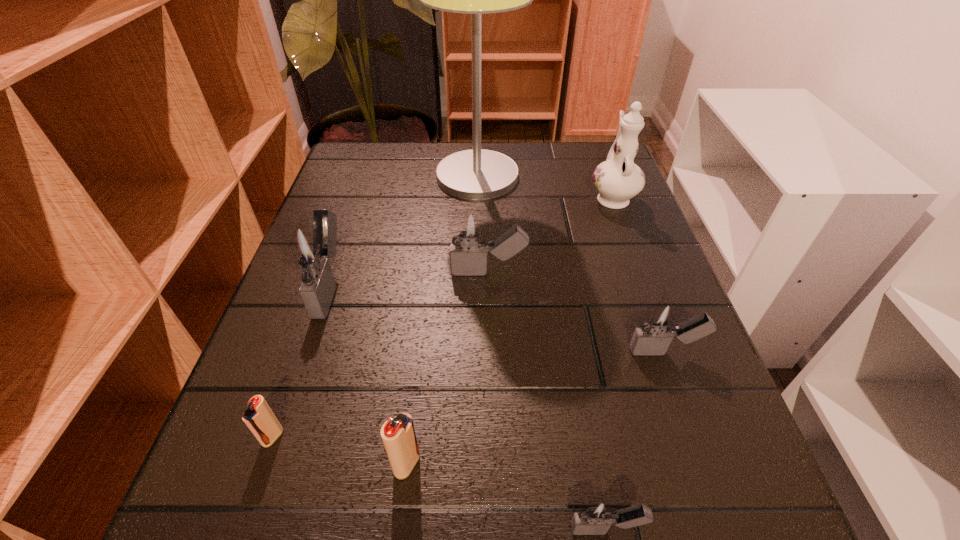
Locate an element on the screen. The height and width of the screenshot is (540, 960). the third nearest igniter is located at coordinates click(x=259, y=418).

The height and width of the screenshot is (540, 960). Find the location of `the smaller red igniter`. the smaller red igniter is located at coordinates (259, 418).

This screenshot has height=540, width=960. In order to click on vacant space located on the left of the tallest object in this screenshot , I will do `click(348, 176)`.

This screenshot has height=540, width=960. I want to click on vacant space located at the spout of the seventh shortest object, so click(x=592, y=143).

At what (x,y) coordinates should I click in order to perform the action: click on vacant space situated 0.130m at the spout of the seventh shortest object. Please return your answer as a coordinate pair (x, y). This screenshot has width=960, height=540. Looking at the image, I should click on [x=596, y=152].

Image resolution: width=960 pixels, height=540 pixels. In order to click on free location located at the spout of the seventh shortest object in this screenshot , I will do [594, 148].

Find the location of a particular element. This screenshot has height=540, width=960. free space located on the right of the leftmost gray igniter is located at coordinates (468, 286).

Locate an element on the screen. The width and height of the screenshot is (960, 540). free region located 0.060m on the front of the fourth igniter from left to right is located at coordinates (490, 312).

This screenshot has width=960, height=540. Identify the location of free spot located on the left of the rightmost igniter. (409, 352).

Where is `vacant region located 0.260m on the back of the right red igniter`? vacant region located 0.260m on the back of the right red igniter is located at coordinates (425, 306).